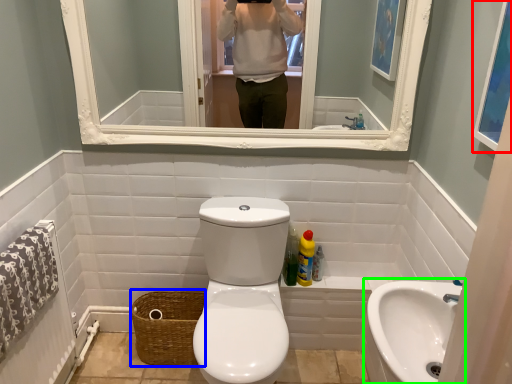
Question: Which is nearer to the picture frame (highlighted by a red box)? basket (highlighted by a blue box) or sink (highlighted by a green box).

Choices:
 (A) basket
 (B) sink

Answer: (B)